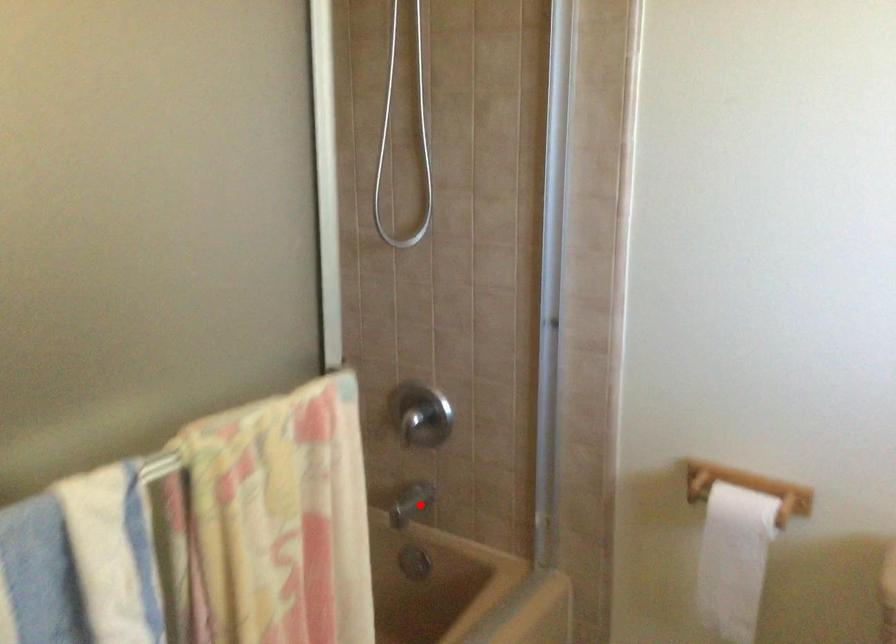
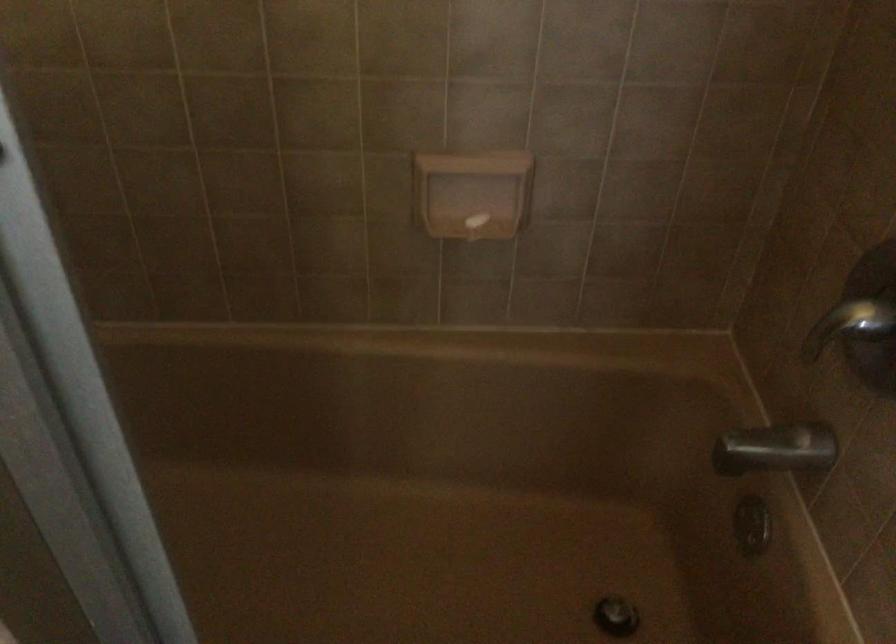
Locate, in the second image, the point that corresponds to the highlighted location in the first image.

(776, 449)